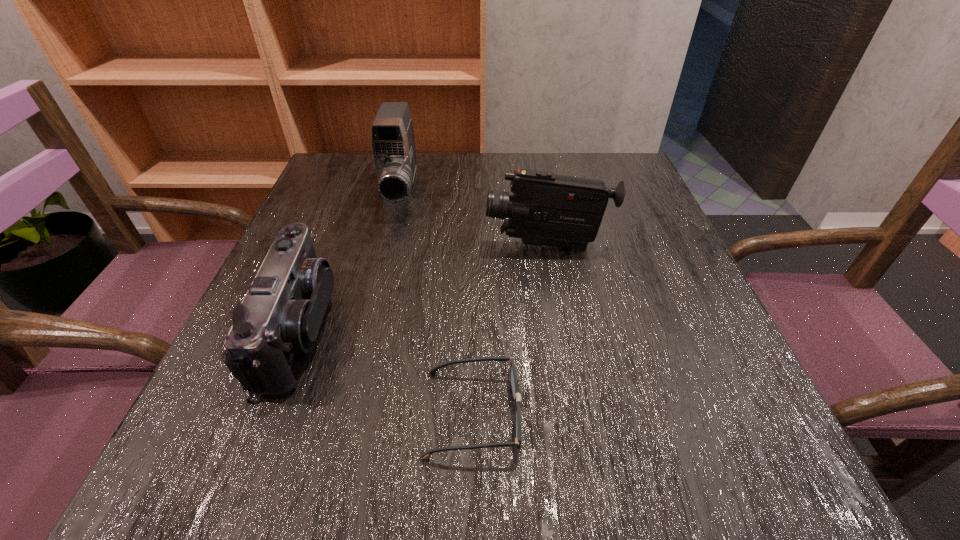
Locate an element on the screen. Image resolution: width=960 pixels, height=540 pixels. free space between the farthest object and the shortest object is located at coordinates (437, 303).

You are a GUI agent. You are given a task and a screenshot of the screen. Output one action in this format:
    pyautogui.click(x=<x>, y=<y>)
    Task: Click on the free space that is in between the second farthest object and the second camcorder from left to right
    This screenshot has width=960, height=540.
    Given the screenshot: What is the action you would take?
    pyautogui.click(x=474, y=219)

Identify the location of vacant region between the second farthest camcorder and the shortest camcorder. (423, 287).

The image size is (960, 540). What are the coordinates of `vacant area that lies between the rightmost camcorder and the spectacles` in the screenshot? It's located at (x=510, y=329).

Locate an element on the screen. This screenshot has height=540, width=960. object that ranks as the third closest to the nearest camcorder is located at coordinates (549, 209).

This screenshot has width=960, height=540. Find the location of `the second closest object relative to the farthest camcorder`. the second closest object relative to the farthest camcorder is located at coordinates (281, 314).

Identify which camcorder is the third nearest to the shortest object. Please provide its 2D coordinates. Your answer should be formatted as a tuple, i.e. [(x, y)], where the tuple contains the x and y coordinates of a point satisfying the conditions above.

[(393, 145)]

Identify the location of the second closest camcorder to the leftmost camcorder. tap(549, 209).